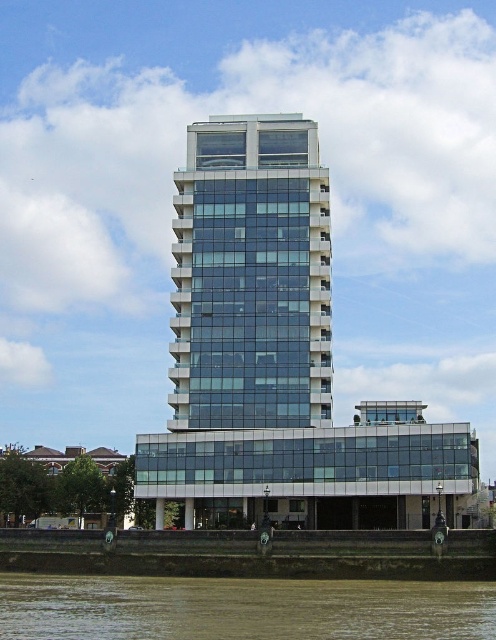
Who is taller, clear glass building at center or brown sedimentary river at lower center?

Standing taller between the two is clear glass building at center.

Between clear glass building at center and brown sedimentary river at lower center, which one appears on the left side from the viewer's perspective?

brown sedimentary river at lower center is more to the left.

Image resolution: width=496 pixels, height=640 pixels. Identify the location of clear glass building at center. (276, 356).

Does transparent glass building at center have a larger size compared to brown sedimentary river at lower center?

Correct, transparent glass building at center is larger in size than brown sedimentary river at lower center.

Between transparent glass building at center and brown sedimentary river at lower center, which one appears on the left side from the viewer's perspective?

brown sedimentary river at lower center is more to the left.

Is point (176, 397) in front of point (347, 593)?

No, it is behind (347, 593).

Locate an element on the screen. transparent glass building at center is located at coordinates (251, 276).

Does clear glass building at center appear on the left side of transparent glass building at center?

Incorrect, clear glass building at center is not on the left side of transparent glass building at center.

The width and height of the screenshot is (496, 640). Identify the location of clear glass building at center. (276, 356).

Locate an element on the screen. clear glass building at center is located at coordinates (276, 356).